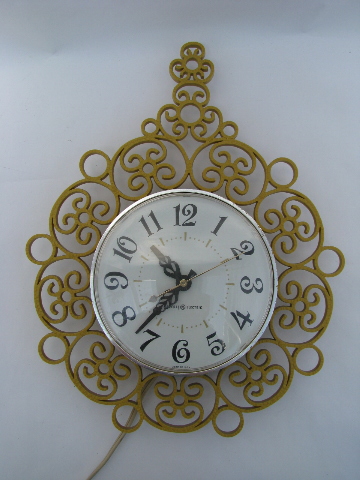
Image resolution: width=360 pixels, height=480 pixels. In order to click on clock face in this screenshot , I will do `click(216, 301)`.